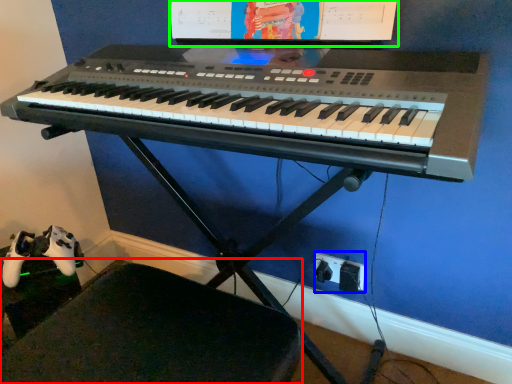
Question: Which is nearer to the swivel chair (highlighted by a red box)? plug (highlighted by a blue box) or computer monitor (highlighted by a green box).

Choices:
 (A) plug
 (B) computer monitor

Answer: (A)